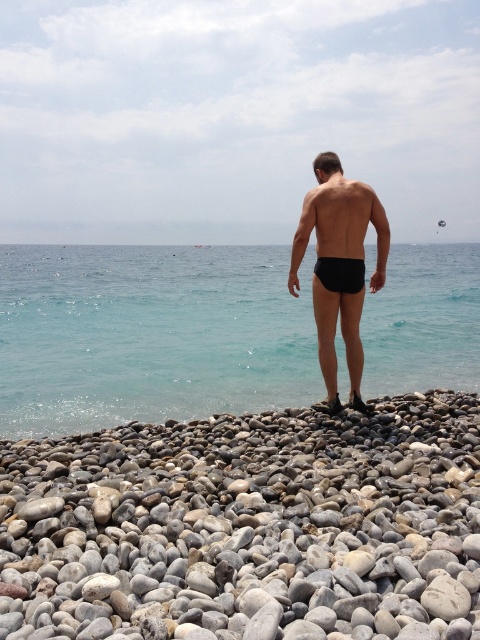
You are standing on the pebble beach and notice the smooth gray pebble at center and the clear blue water at center. Which object is located below the other?

The smooth gray pebble at center is positioned under the clear blue water at center.

You are standing on the pebble beach and want to wade into the clear blue water at center. Based on the coordinates provided, is the water directly in front of you or to one side?

The clear blue water at center is located at point coordinates, so it is directly in front of you.